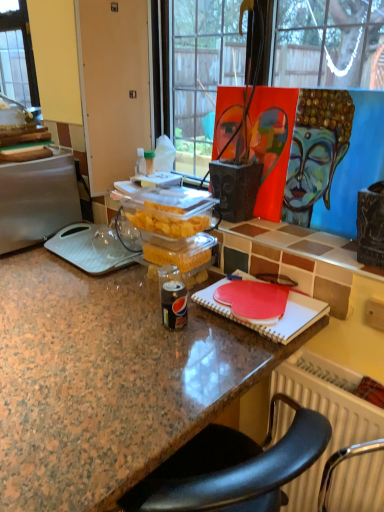
Question: From a real-world perspective, does granite countertop at center sit lower than painted canvas at upper right?

Choices:
 (A) no
 (B) yes

Answer: (B)

Question: Considering the relative sizes of granite countertop at center and painted canvas at upper right in the image provided, is granite countertop at center taller than painted canvas at upper right?

Choices:
 (A) yes
 (B) no

Answer: (A)

Question: From the image's perspective, is granite countertop at center on top of painted canvas at upper right?

Choices:
 (A) no
 (B) yes

Answer: (A)

Question: Is granite countertop at center positioned before painted canvas at upper right?

Choices:
 (A) no
 (B) yes

Answer: (B)

Question: From the image's perspective, is granite countertop at center under painted canvas at upper right?

Choices:
 (A) no
 (B) yes

Answer: (B)

Question: Is granite countertop at center next to painted canvas at upper right and touching it?

Choices:
 (A) no
 (B) yes

Answer: (A)

Question: Can you confirm if painted canvas at upper right is thinner than silver metallic fridge at left?

Choices:
 (A) yes
 (B) no

Answer: (A)

Question: Is painted canvas at upper right next to silver metallic fridge at left?

Choices:
 (A) no
 (B) yes

Answer: (A)

Question: Considering the relative positions of painted canvas at upper right and silver metallic fridge at left in the image provided, is painted canvas at upper right to the right of silver metallic fridge at left from the viewer's perspective?

Choices:
 (A) no
 (B) yes

Answer: (B)

Question: From a real-world perspective, is painted canvas at upper right under silver metallic fridge at left?

Choices:
 (A) no
 (B) yes

Answer: (A)

Question: Considering the relative sizes of painted canvas at upper right and silver metallic fridge at left in the image provided, is painted canvas at upper right shorter than silver metallic fridge at left?

Choices:
 (A) no
 (B) yes

Answer: (A)

Question: Considering the relative sizes of painted canvas at upper right and silver metallic fridge at left in the image provided, is painted canvas at upper right taller than silver metallic fridge at left?

Choices:
 (A) no
 (B) yes

Answer: (B)

Question: Is silver metallic fridge at left not near granite countertop at center?

Choices:
 (A) no
 (B) yes

Answer: (A)